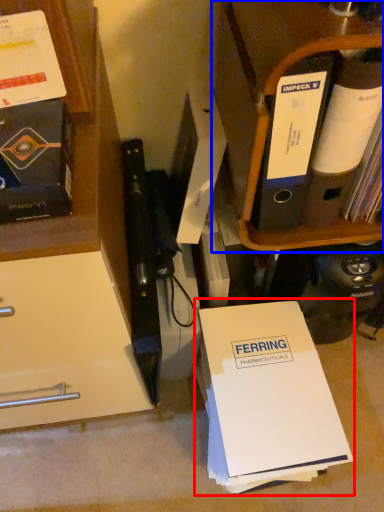
Question: Which object is closer to the camera taking this photo, paperback book (highlighted by a red box) or shelf (highlighted by a blue box)?

Choices:
 (A) paperback book
 (B) shelf

Answer: (B)